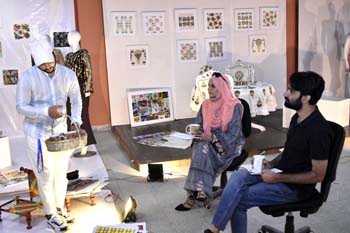
This screenshot has width=350, height=233. Identify the location of coffee mugs. (256, 163), (192, 130).